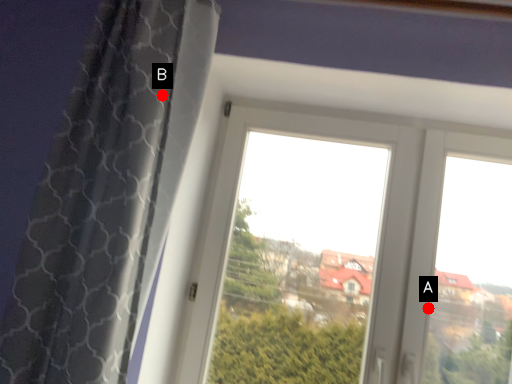
Question: Two points are circled on the image, labeled by A and B beside each circle. Which point is further to the camera?

Choices:
 (A) A is further
 (B) B is further

Answer: (A)